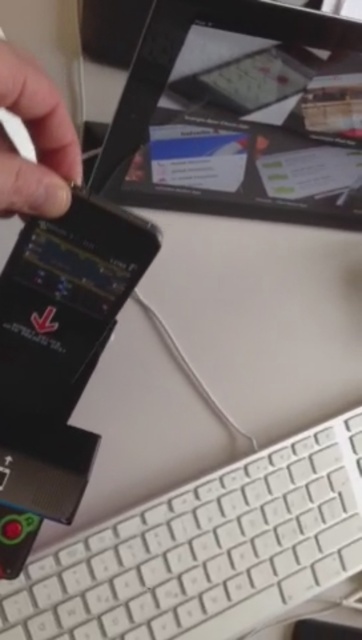
You are setting up a presentation and need to place your black glossy tablet at upper center and white plastic keyboard at lower right on a table. If the table has limited space, which object requires more horizontal space?

The white plastic keyboard at lower right requires more horizontal space because its width is greater than the black glossy tablet at upper center.

You are trying to reach the black glossy tablet at upper center from the matte black finger at upper left. Which direction should you move your hand to touch the tablet?

The black glossy tablet at upper center is positioned on the right side of the matte black finger at upper left. To touch the tablet, you should move your hand to the right.

You are a user trying to interact with the two points on the screen. Which point is closer to you, the point at coordinates point (139,568) or point (20,118)?

Point (20,118) is closer to you because it is in front of point (139,568).